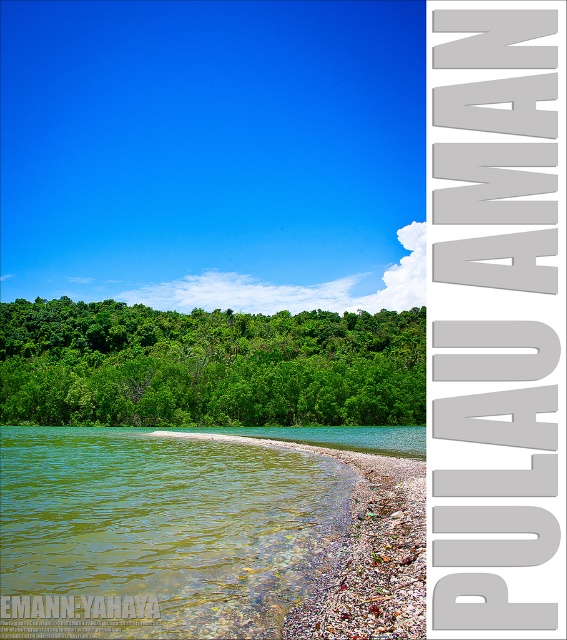
You are standing on the beach and want to walk to the green leafy trees at center. However, you notice the green translucent water at lower left between you and the trees. Can you walk directly to the trees without crossing the water?

The green translucent water at lower left is positioned on the right side of the green leafy trees at center, so you would need to walk around the water to reach the trees without crossing it.

You are standing on the shore of the coastal scene and want to determine the relative heights of the green translucent water at lower left and the green leafy trees at center. Which object appears taller from your vantage point?

The green leafy trees at center appear taller than the green translucent water at lower left because the description states that the green translucent water at lower left is shorter than the green leafy trees at center.

You are standing at the shoreline in this coastal scene and want to determine which of the two points, point (276, 545) or point (243, 369), is nearer to you. Based on the image, which point is closer?

Point (276, 545) is closer to the camera than point (243, 369), so it is the nearer point.